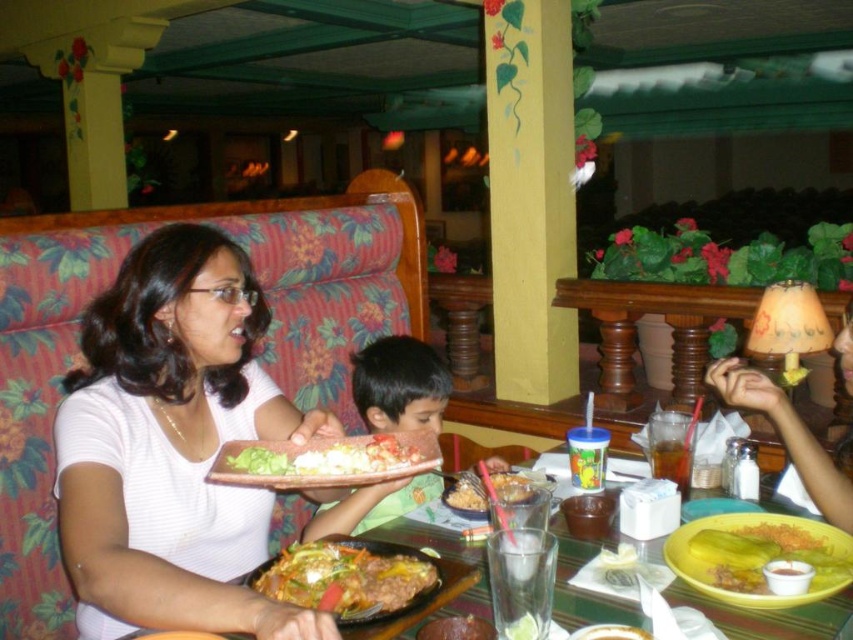
Question: Does shiny plastic tray at center lie behind slightly browned rice at center?

Choices:
 (A) yes
 (B) no

Answer: (B)

Question: From the image, what is the correct spatial relationship of brown hair boy at center in relation to matte white shirt at center?

Choices:
 (A) right
 (B) left

Answer: (B)

Question: Is white matte shirt at center thinner than matte white shirt at center?

Choices:
 (A) no
 (B) yes

Answer: (A)

Question: Which of the following is the closest to the observer?

Choices:
 (A) shiny plastic tray at center
 (B) matte white shirt at center
 (C) yellow matte plate at lower right

Answer: (C)

Question: Which point is closer to the camera taking this photo?

Choices:
 (A) (469, 628)
 (B) (732, 516)
 (C) (769, 385)
 (D) (140, 333)

Answer: (A)

Question: Which point is closer to the camera taking this photo?

Choices:
 (A) (759, 396)
 (B) (177, 573)

Answer: (B)